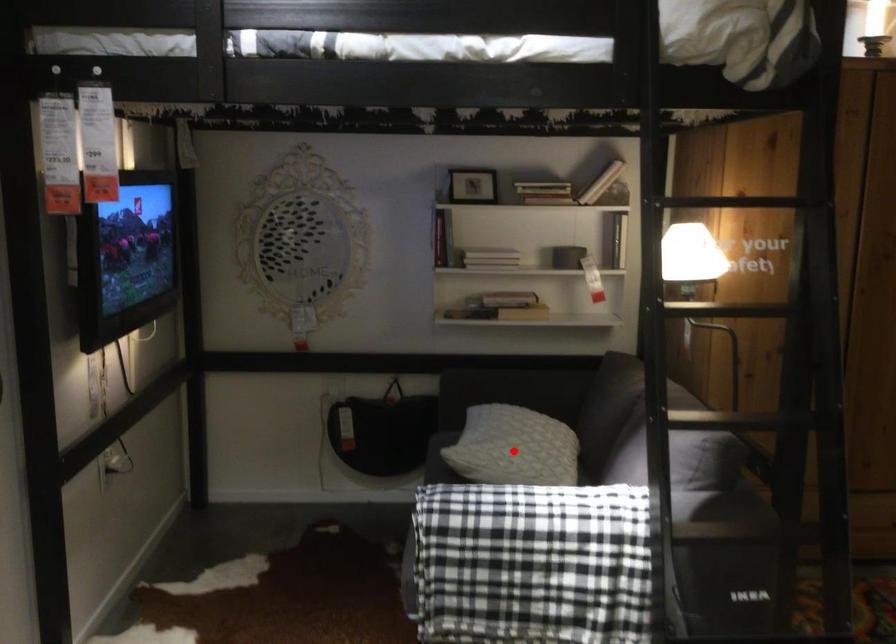
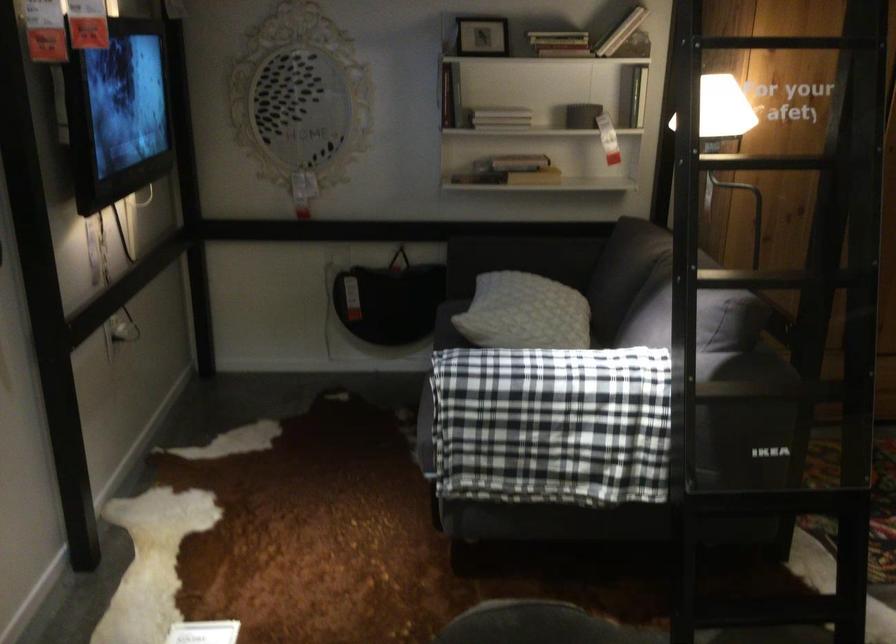
Find the pixel in the second image that matches the highlighted location in the first image.

(524, 313)